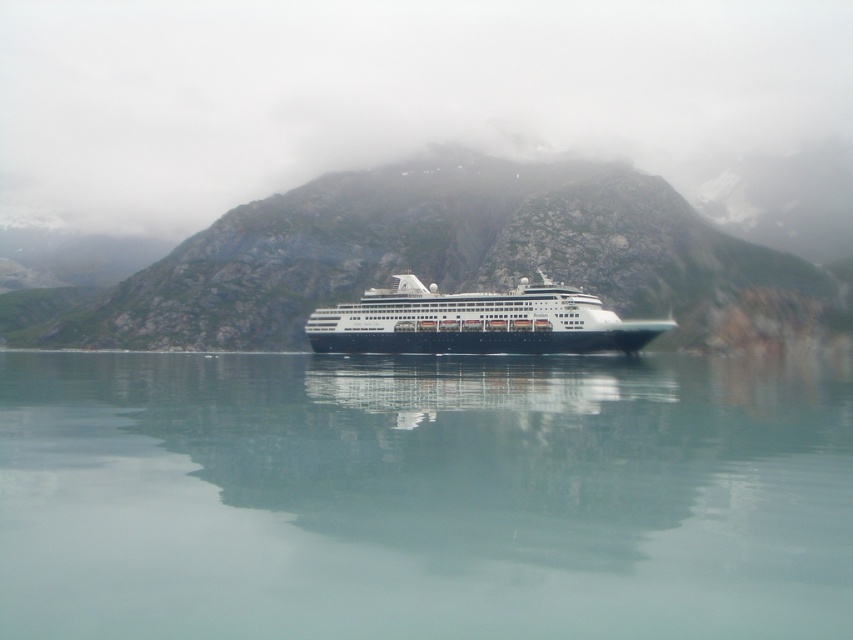
Based on the photo, you are a photographer standing at the edge of the cruise ship deck. You want to capture the rocky mountain at center in your shot. Based on its 2D location coordinates, where should you aim your camera?

The rocky mountain at center is located at the 2D coordinates point (445, 259), so you should aim your camera towards that point to capture it.

You are a photographer aiming to capture the cruise ship and its surroundings. Based on the scene, which object between the clear water at center and the rocky mountain at center occupies a smaller horizontal space in the image?

The clear water at center has a lesser width compared to the rocky mountain at center, so the clear water at center occupies a smaller horizontal space in the image.

You are an observer on the deck of the shiny black cruise ship at center. Looking towards the rocky mountain at center, which object is closer to you?

The rocky mountain at center is closer to you because it is positioned further to the viewer than the shiny black cruise ship at center, meaning from your vantage point on the ship, the mountain appears nearer in the visual plane.